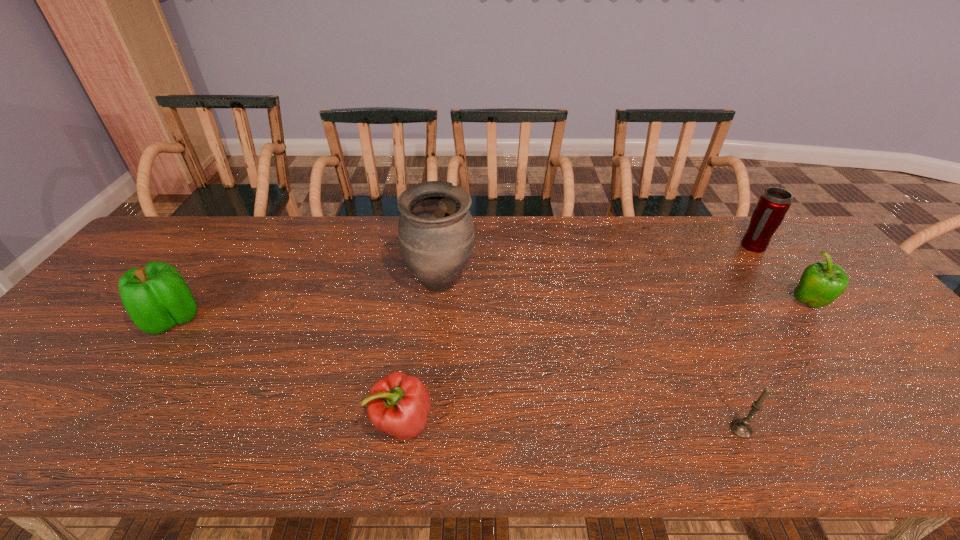
The width and height of the screenshot is (960, 540). In order to click on vacant space located 0.180m on the front of the rightmost bell pepper in this screenshot , I will do `click(864, 372)`.

The width and height of the screenshot is (960, 540). I want to click on free space located on the right of the fourth object from left to right, so click(x=927, y=429).

You are a GUI agent. You are given a task and a screenshot of the screen. Output one action in this format:
    pyautogui.click(x=<x>, y=<y>)
    Task: Click on the blank space located 0.230m on the back of the shortest bell pepper
    This screenshot has height=540, width=960.
    Given the screenshot: What is the action you would take?
    pyautogui.click(x=418, y=321)

Image resolution: width=960 pixels, height=540 pixels. I want to click on object present at the far edge, so click(774, 203).

Find the location of a particular element. candle that is at the near edge is located at coordinates (742, 428).

Image resolution: width=960 pixels, height=540 pixels. What are the coordinates of `bell pepper that is at the near edge` in the screenshot? It's located at (398, 404).

The height and width of the screenshot is (540, 960). Find the location of `thermos bottle situated at the right edge`. thermos bottle situated at the right edge is located at coordinates (774, 203).

Find the location of a particular element. This screenshot has width=960, height=540. bell pepper positioned at the right edge is located at coordinates (821, 283).

At what (x,y) coordinates should I click in order to perform the action: click on object that is at the far right corner. Please return your answer as a coordinate pair (x, y). This screenshot has width=960, height=540. Looking at the image, I should click on (774, 203).

You are a GUI agent. You are given a task and a screenshot of the screen. Output one action in this format:
    pyautogui.click(x=<x>, y=<y>)
    Task: Click on the free space at the far edge of the desktop
    The image size is (960, 540).
    Given the screenshot: What is the action you would take?
    pyautogui.click(x=303, y=245)